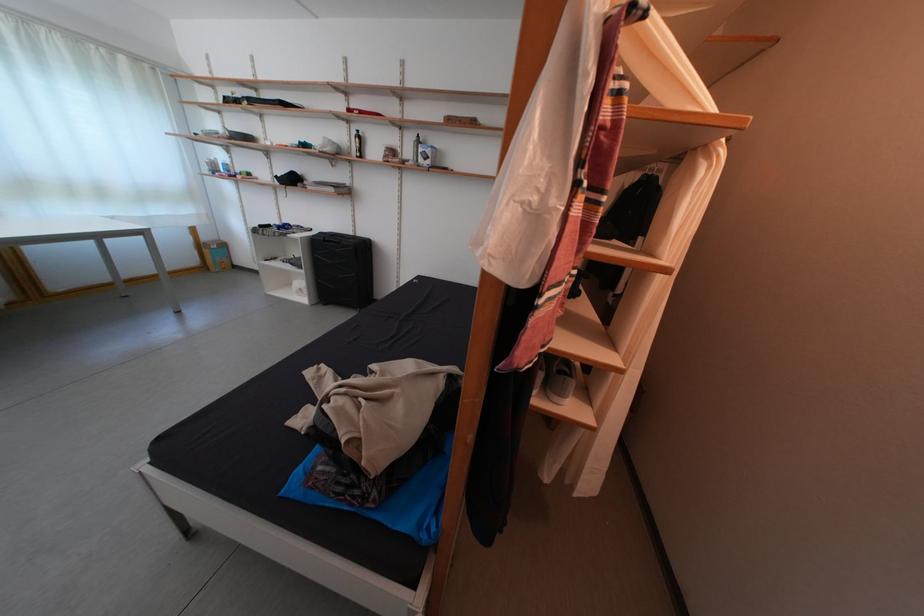
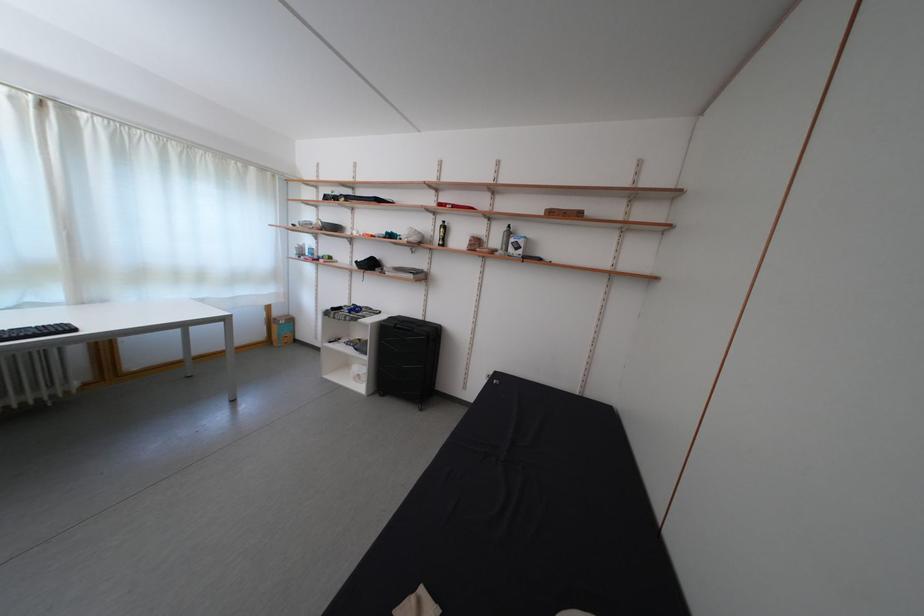
Find the pixel in the second image that matches [213,244] in the first image.

(285, 320)